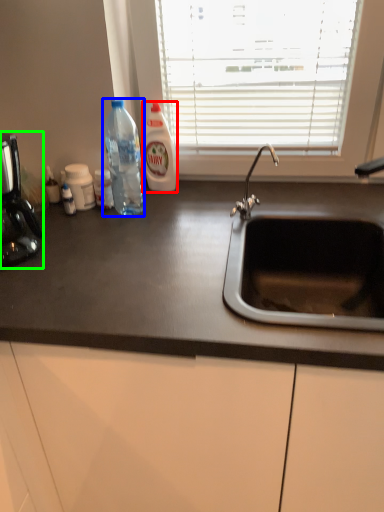
Question: Estimate the real-world distances between objects in this image. Which object is farther from cleaning product (highlighted by a red box), bottle (highlighted by a blue box) or coffee machine (highlighted by a green box)?

Choices:
 (A) bottle
 (B) coffee machine

Answer: (B)